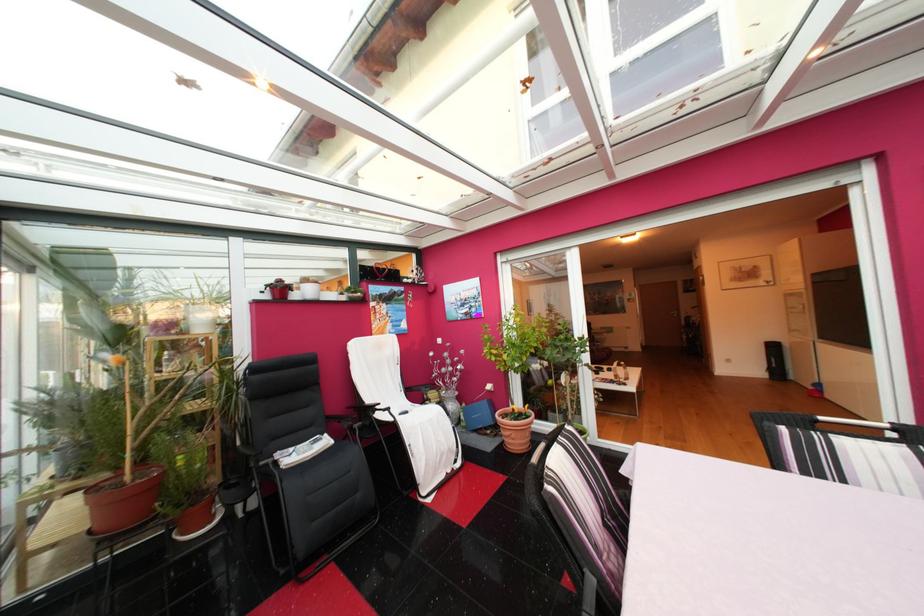
Where would you sit the black chair sitting surface? Please return your answer as a coordinate pair (x, y).

(301, 468)